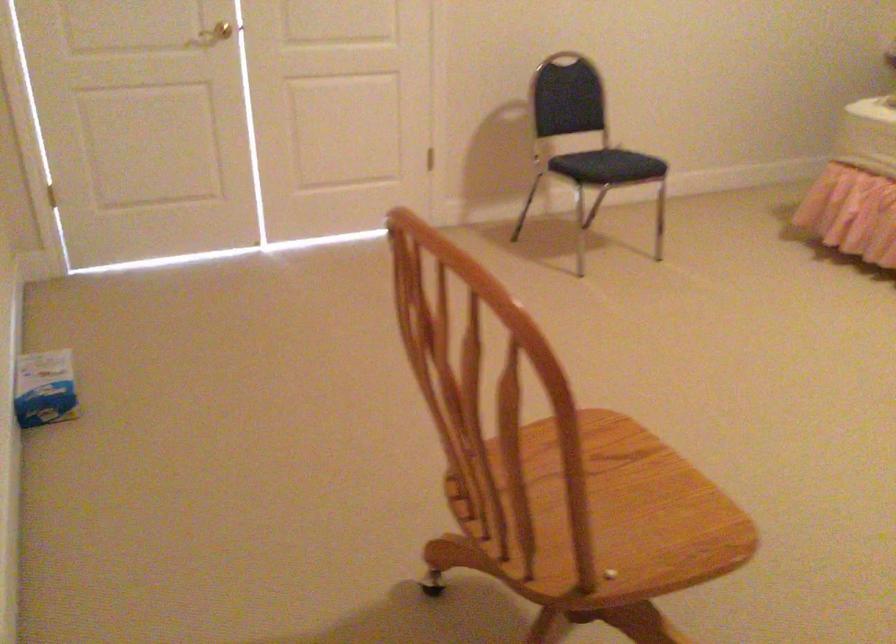
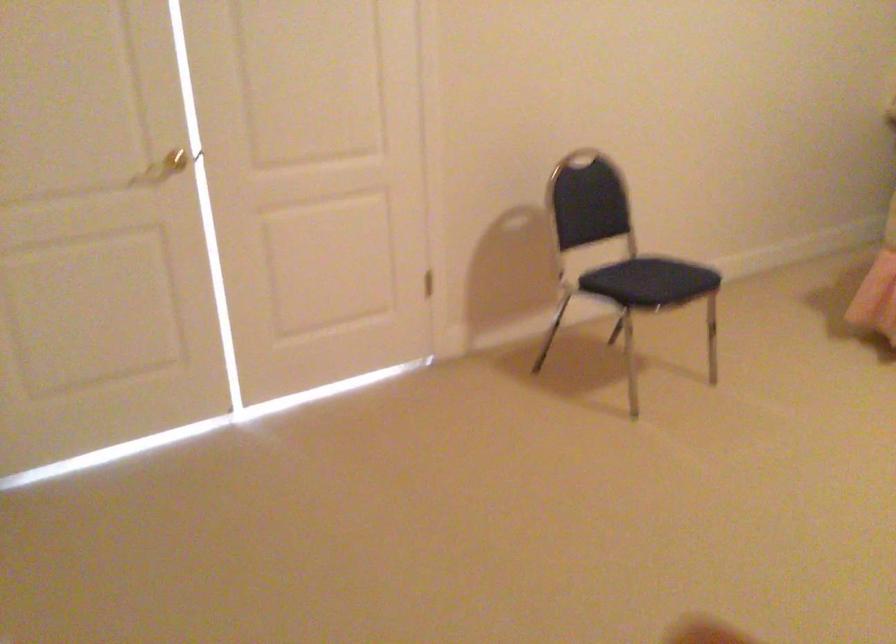
Question: In a continuous first-person perspective shot, in which direction is the camera moving?

Choices:
 (A) Left
 (B) Right
 (C) Forward
 (D) Backward

Answer: (C)